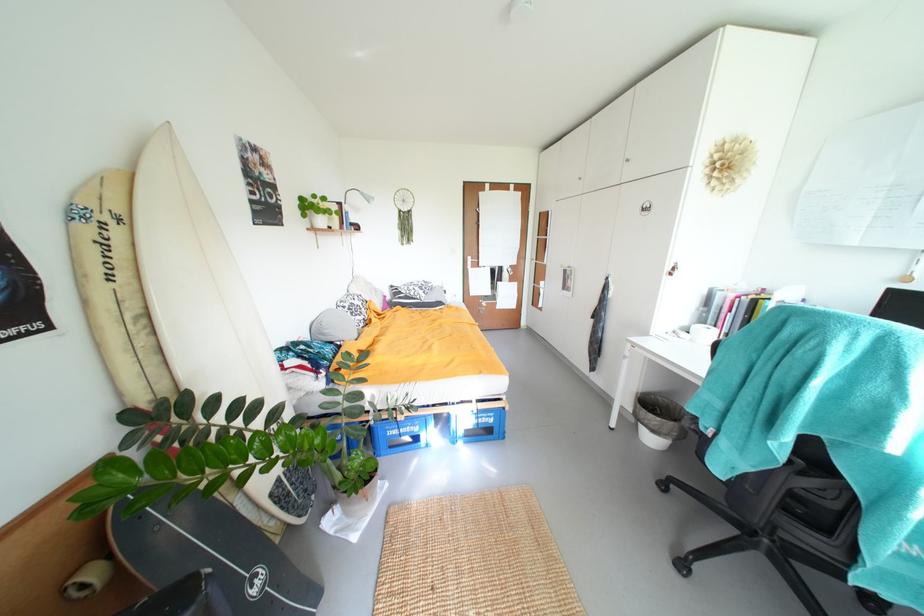
This screenshot has width=924, height=616. What do you see at coordinates (400, 434) in the screenshot?
I see `the blue plastic crate` at bounding box center [400, 434].